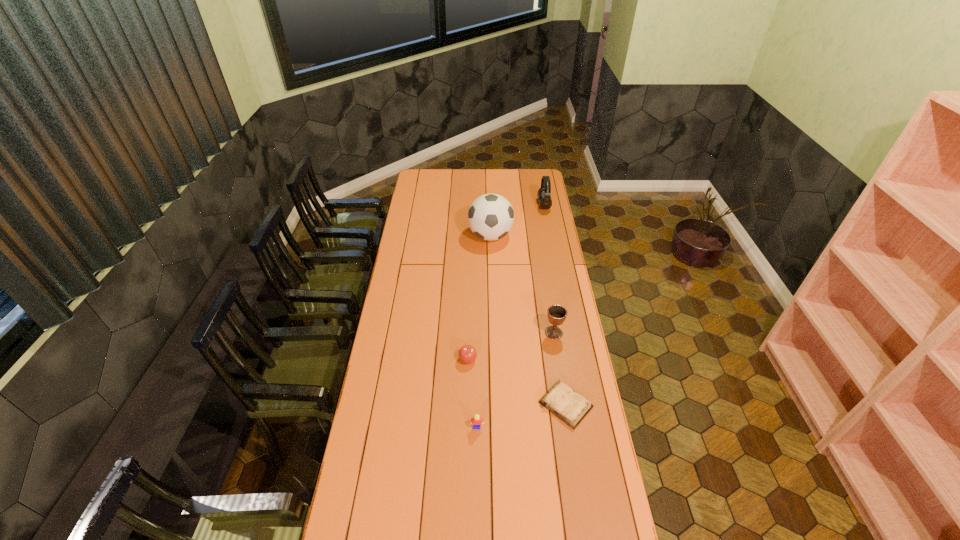
The height and width of the screenshot is (540, 960). I want to click on blank region between the diary and the Lego, so click(521, 416).

This screenshot has height=540, width=960. What are the coordinates of `free space between the soccer ball and the fourth farthest object` in the screenshot? It's located at (479, 298).

Identify which object is located as the second nearest to the soccer ball. Please provide its 2D coordinates. Your answer should be formatted as a tuple, i.e. [(x, y)], where the tuple contains the x and y coordinates of a point satisfying the conditions above.

[(556, 314)]

Locate which object is the third closest to the shortest object. Please provide its 2D coordinates. Your answer should be formatted as a tuple, i.e. [(x, y)], where the tuple contains the x and y coordinates of a point satisfying the conditions above.

[(467, 353)]

At what (x,y) coordinates should I click in order to perform the action: click on vacant region that satisfies the following two spatial constraints: 1. on the earcups of the headset; 2. on the front-facing side of the Lego. Please return your answer as a coordinate pair (x, y). Looking at the image, I should click on (586, 427).

Where is `vacant position in the image that satisfies the following two spatial constraints: 1. on the earcups of the fifth shortest object; 2. on the front side of the third tallest object`? The width and height of the screenshot is (960, 540). vacant position in the image that satisfies the following two spatial constraints: 1. on the earcups of the fifth shortest object; 2. on the front side of the third tallest object is located at coordinates (567, 333).

Identify the location of vacant space that satisfies the following two spatial constraints: 1. on the earcups of the second tallest object; 2. on the front-facing side of the Lego. The image size is (960, 540). (586, 427).